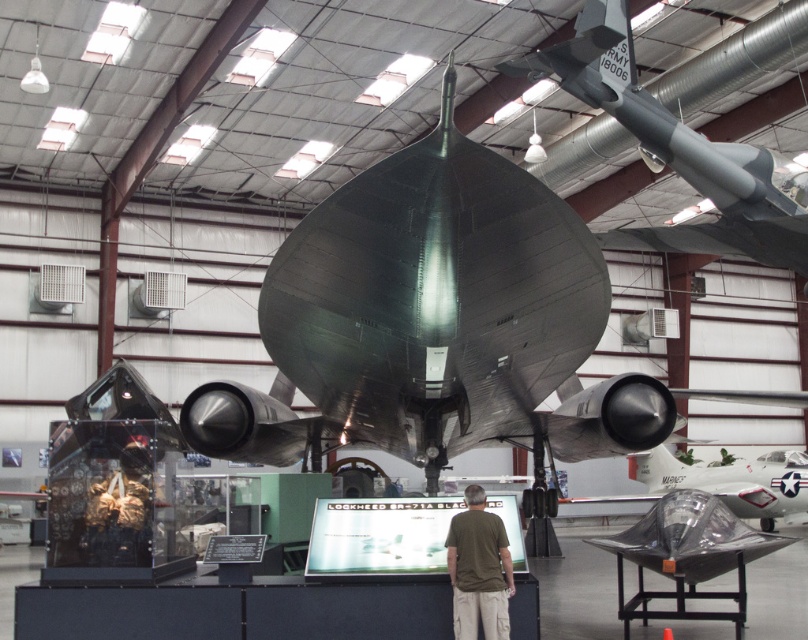
From the picture: Which of these two, matte gray missile at upper right or dark green t-shirt at center, stands shorter?

Standing shorter between the two is dark green t-shirt at center.

Can you confirm if matte gray missile at upper right is shorter than dark green t-shirt at center?

No.

Locate an element on the screen. Image resolution: width=808 pixels, height=640 pixels. matte gray missile at upper right is located at coordinates (680, 154).

Where is `matte gray missile at upper right`? matte gray missile at upper right is located at coordinates (680, 154).